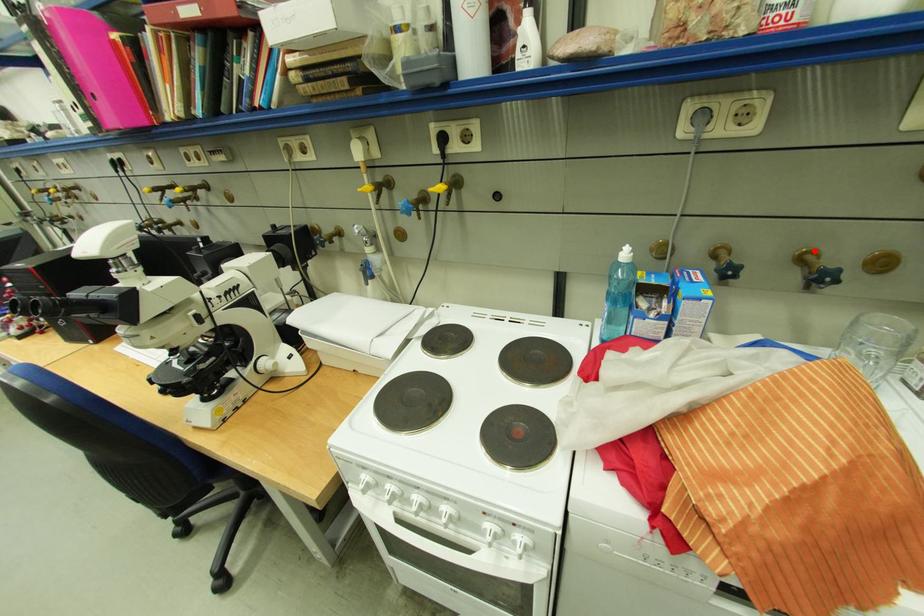
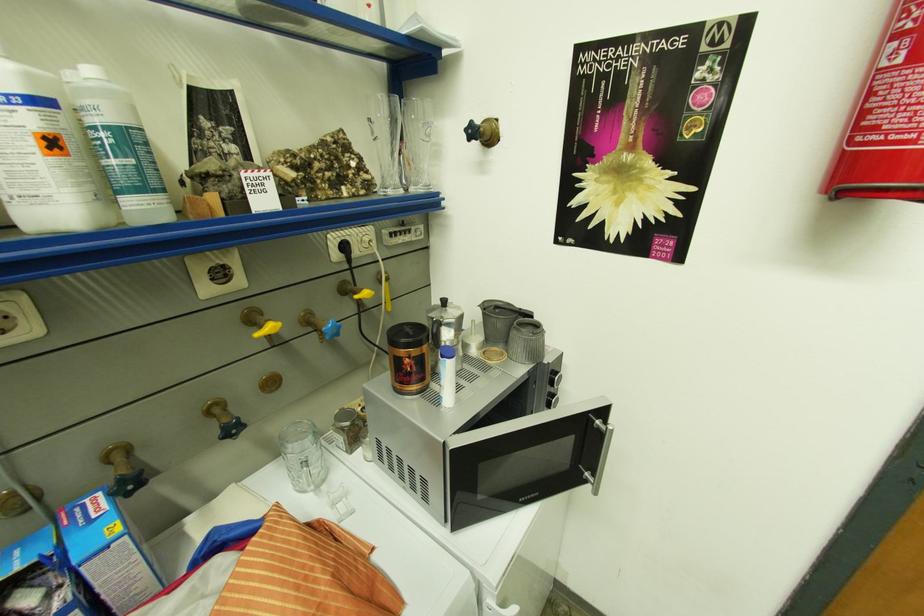
The point at the highlighted location is marked in the first image. Where is the corresponding point in the second image?

(219, 405)